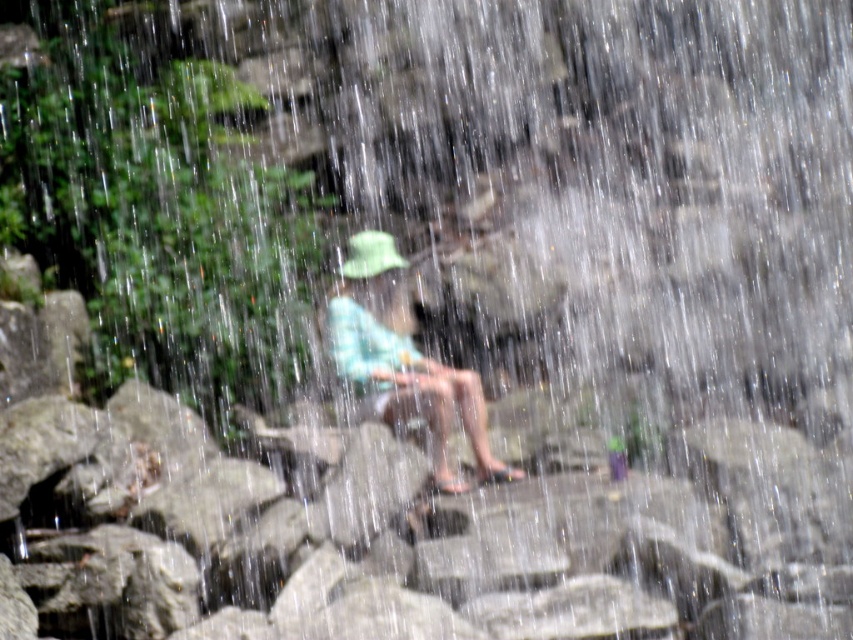
Does light blue fabric hat at center have a greater height compared to green fabric hat at center?

Yes, light blue fabric hat at center is taller than green fabric hat at center.

What do you see at coordinates (402, 358) in the screenshot?
I see `light blue fabric hat at center` at bounding box center [402, 358].

Is point (462, 394) positioned after point (375, 248)?

That is False.

Where is `light blue fabric hat at center`? Image resolution: width=853 pixels, height=640 pixels. light blue fabric hat at center is located at coordinates (402, 358).